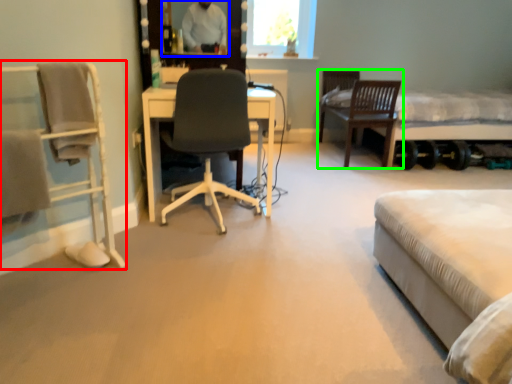
Question: Considering the real-world distances, which object is farthest from chair (highlighted by a red box)? mirror (highlighted by a blue box) or chair (highlighted by a green box)?

Choices:
 (A) mirror
 (B) chair

Answer: (B)